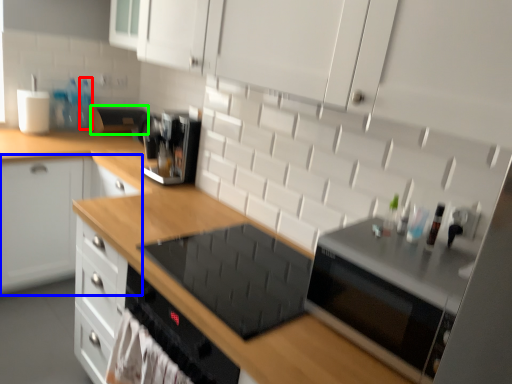
Question: Which is farther away from bottle (highlighted by a red box)? cabinetry (highlighted by a blue box) or appliance (highlighted by a green box)?

Choices:
 (A) cabinetry
 (B) appliance

Answer: (A)